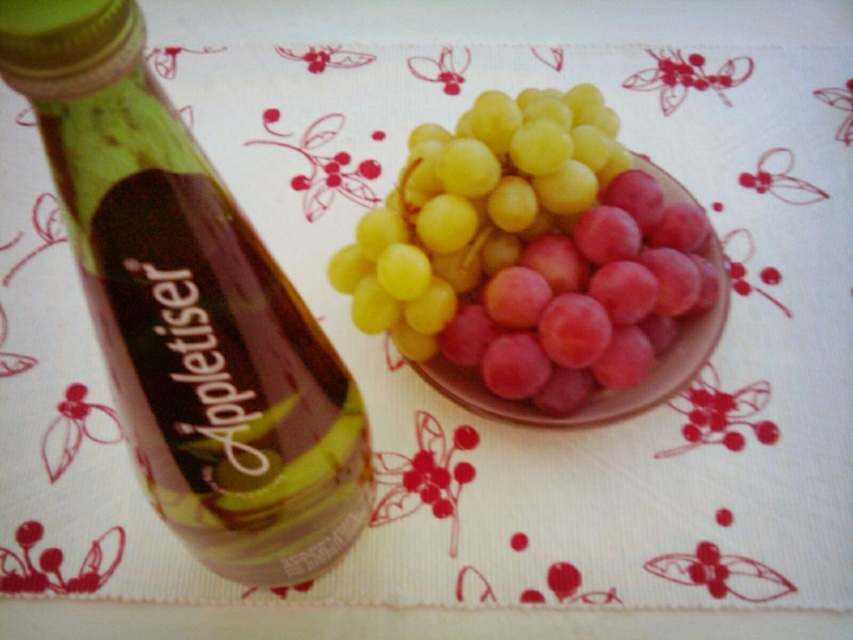
Question: Is green glass bottle at left to the right of pink matte grape at center from the viewer's perspective?

Choices:
 (A) no
 (B) yes

Answer: (A)

Question: Which point is farther to the camera?

Choices:
 (A) (381, 298)
 (B) (281, 376)
 (C) (672, 388)

Answer: (C)

Question: Estimate the real-world distances between objects in this image. Which object is farther from the green glass bottle at left?

Choices:
 (A) yellow matte grapes at center
 (B) pink matte grape at center

Answer: (B)

Question: Is yellow matte grapes at center closer to the viewer compared to pink matte grape at center?

Choices:
 (A) no
 (B) yes

Answer: (B)

Question: Which point is farther to the camera?

Choices:
 (A) (722, 310)
 (B) (397, 182)
 (C) (195, 182)

Answer: (B)

Question: Is green glass bottle at left positioned in front of yellow matte grapes at center?

Choices:
 (A) no
 (B) yes

Answer: (B)